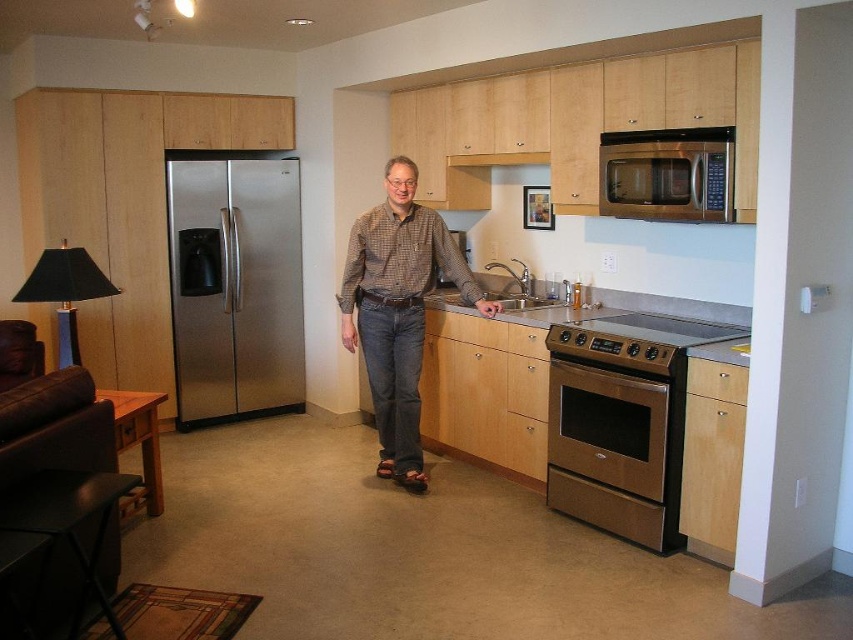
Question: Which of the following is the farthest from the observer?

Choices:
 (A) (579, 337)
 (B) (386, 365)
 (C) (650, 195)
 (D) (604, 448)

Answer: (B)

Question: Which point is closer to the camera?

Choices:
 (A) [x=413, y=332]
 (B) [x=561, y=360]

Answer: (B)

Question: Which object is closer to the camera taking this photo?

Choices:
 (A) brown checkered shirt at center
 (B) stainless steel microwave at upper right
 (C) bronze metallic oven at lower right

Answer: (C)

Question: Is stainless steel refrigerator at left further to the viewer compared to brown checkered shirt at center?

Choices:
 (A) yes
 (B) no

Answer: (A)

Question: Can you confirm if stainless steel refrigerator at left is positioned below brown checkered shirt at center?

Choices:
 (A) no
 (B) yes

Answer: (A)

Question: Is bronze metallic oven at lower right smaller than stainless steel oven at lower right?

Choices:
 (A) yes
 (B) no

Answer: (B)